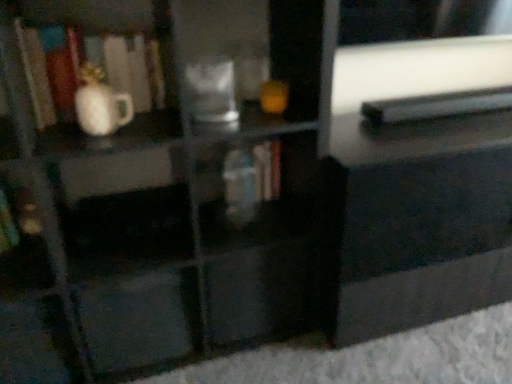
Question: Relative to hardcover book at center, which is the 2th book from right to left, is black glossy drawer at center, the 2th drawer viewed from the left, in front or behind?

Choices:
 (A) behind
 (B) front

Answer: (B)

Question: From a real-world perspective, relative to hardcover book at center, the second book viewed from the left, is black glossy drawer at center, which is the 1th drawer from right to left, vertically above or below?

Choices:
 (A) above
 (B) below

Answer: (B)

Question: Estimate the real-world distances between objects in this image. Which object is farther from the black glossy drawer at center, which is the 1th drawer from right to left?

Choices:
 (A) black plastic book at upper right, the 3th book viewed from the left
 (B) white glossy mug at upper left, marked as the 1th book in a left-to-right arrangement
 (C) hardcover book at center, which is the 2th book from right to left
 (D) white glossy vase at left
 (E) matte black drawer at center, which is counted as the 2th drawer, starting from the right

Answer: (A)

Question: Considering the real-world distances, which object is farthest from the white glossy vase at left?

Choices:
 (A) hardcover book at center, which is the 2th book from right to left
 (B) matte black drawer at center, the first drawer positioned from the left
 (C) white glossy mug at upper left, marked as the 1th book in a left-to-right arrangement
 (D) black plastic book at upper right, the 3th book viewed from the left
 (E) black glossy drawer at center, which is the 1th drawer from right to left

Answer: (D)